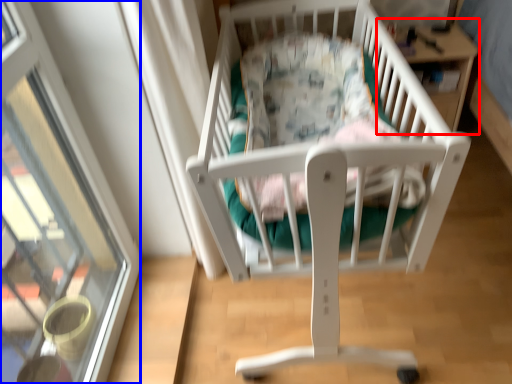
Question: Which of the following is the closest to the observer, table (highlighted by a red box) or glass door (highlighted by a blue box)?

Choices:
 (A) table
 (B) glass door

Answer: (B)